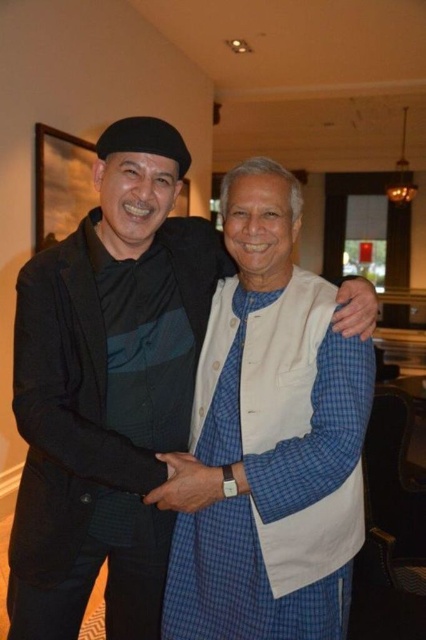
Question: Which of the following is the farthest from the observer?

Choices:
 (A) (209, 420)
 (B) (54, 189)
 (C) (155, 144)

Answer: (B)

Question: Which object is the farthest from the white cotton apron at center?

Choices:
 (A) blue checkered kurta at center
 (B) wooden frame at upper left

Answer: (B)

Question: Does blue checkered kurta at center have a lesser width compared to wooden frame at upper left?

Choices:
 (A) no
 (B) yes

Answer: (A)

Question: Does white cotton apron at center have a larger size compared to wooden frame at upper left?

Choices:
 (A) yes
 (B) no

Answer: (A)

Question: Estimate the real-world distances between objects in this image. Which object is closer to the wooden frame at upper left?

Choices:
 (A) blue checkered kurta at center
 (B) white cotton apron at center

Answer: (A)

Question: Is blue checkered kurta at center closer to the viewer compared to wooden frame at upper left?

Choices:
 (A) no
 (B) yes

Answer: (B)